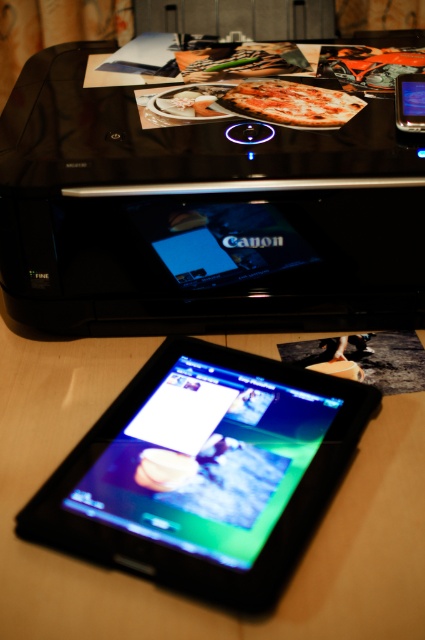
Based on the photo, you are standing in front of the workspace shown in the image. You need to place a new label on the black glossy printer at upper center. Where should you place the label according to its 2D coordinates?

The label should be placed at the 2D coordinates point (200, 212) as specified for the black glossy printer at upper center.

You are holding a smartphone that is 6 inches wide. You want to place it on the same surface as the black glossy tablet at center. Can you fit it there without overlapping the tablet?

The black glossy tablet at center is 18.33 inches from viewer. Since the smartphone is only 6 inches wide, it can easily be placed on the same surface without overlapping the tablet as there is sufficient space available.

You are standing in front of the workspace setup. You need to reach the black glossy printer at upper center to load paper. Considering your arm can only extend 24 inches, can you reach it?

The black glossy printer at upper center is 26.34 inches from the camera, which is beyond your arm extension of 24 inches. Therefore, you cannot reach it.